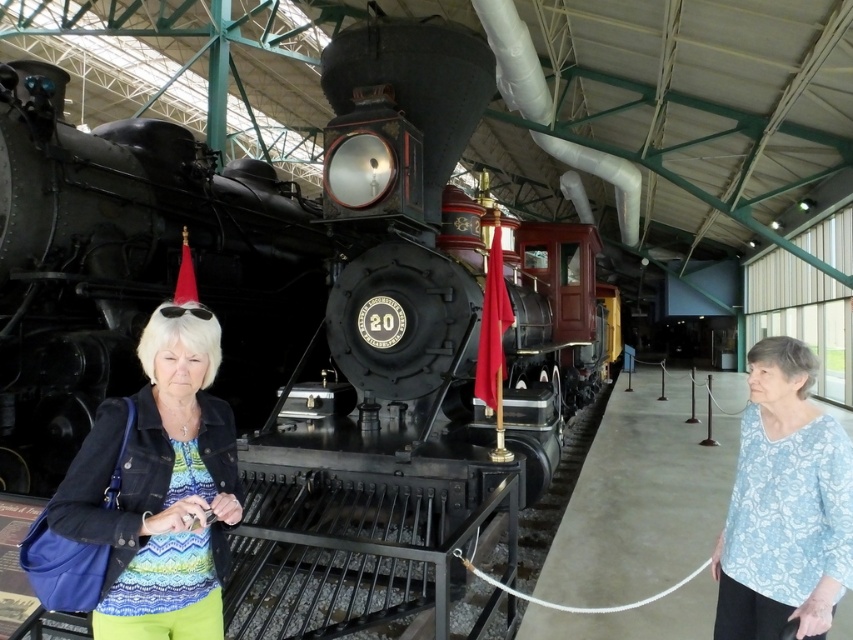
Question: Is denim jacket at center bigger than blue floral blouse at center?

Choices:
 (A) yes
 (B) no

Answer: (B)

Question: Among these objects, which one is nearest to the camera?

Choices:
 (A) denim jacket at center
 (B) blue floral blouse at center

Answer: (A)

Question: Considering the relative positions of denim jacket at center and blue floral blouse at center in the image provided, where is denim jacket at center located with respect to blue floral blouse at center?

Choices:
 (A) right
 (B) left

Answer: (B)

Question: Which of the following is the closest to the observer?

Choices:
 (A) (160, 548)
 (B) (773, 557)

Answer: (A)

Question: Among these objects, which one is nearest to the camera?

Choices:
 (A) blue floral blouse at center
 (B) denim jacket at center

Answer: (B)

Question: Is denim jacket at center to the right of blue floral blouse at center from the viewer's perspective?

Choices:
 (A) yes
 (B) no

Answer: (B)